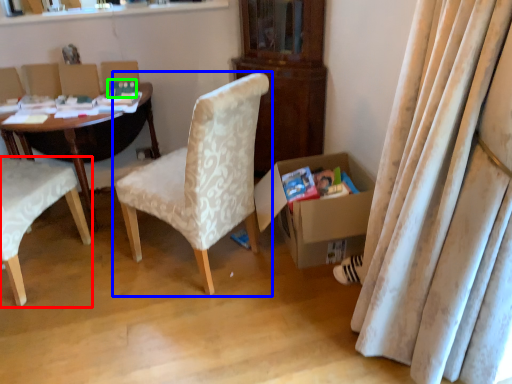
Question: Estimate the real-world distances between objects in this image. Which object is farther from chair (highlighted by a red box), chair (highlighted by a blue box) or paperback book (highlighted by a green box)?

Choices:
 (A) chair
 (B) paperback book

Answer: (B)